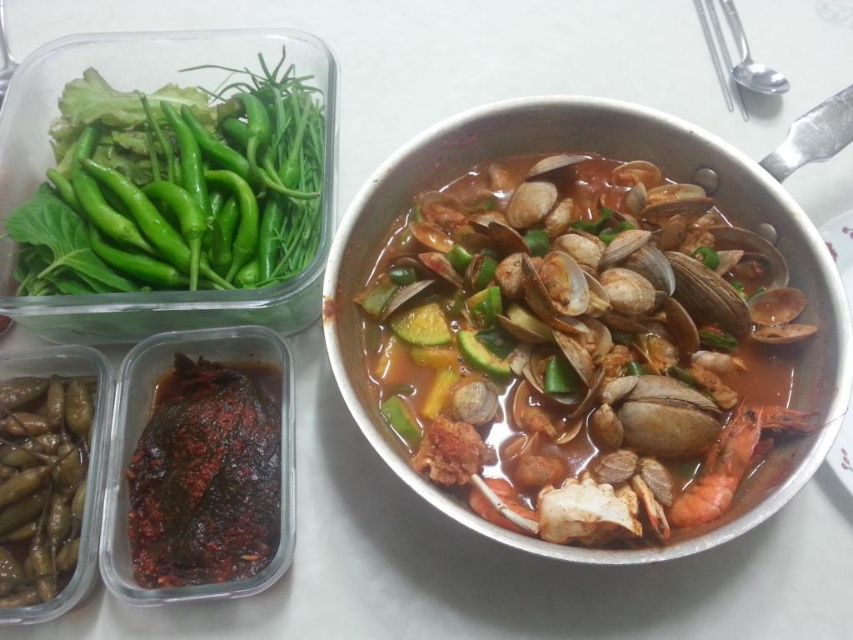
Question: Which point is farther to the camera?

Choices:
 (A) 91,72
 (B) 726,440

Answer: (A)

Question: Estimate the real-world distances between objects in this image. Which object is farther from the brown glossy clams at center?

Choices:
 (A) pickled green beans at lower left
 (B) green glossy chili peppers at upper left
 (C) shiny orange shrimp at right

Answer: (A)

Question: Is the position of green glossy chili peppers at upper left less distant than that of shiny orange shrimp at right?

Choices:
 (A) no
 (B) yes

Answer: (A)

Question: Does green glossy chili peppers at upper left have a greater width compared to dark brown glossy fish at lower left?

Choices:
 (A) yes
 (B) no

Answer: (A)

Question: Is brown glossy clams at center below dark brown glossy fish at lower left?

Choices:
 (A) yes
 (B) no

Answer: (B)

Question: Considering the real-world distances, which object is closest to the brown glossy clams at center?

Choices:
 (A) dark brown glossy fish at lower left
 (B) pickled green beans at lower left
 (C) shiny orange shrimp at right

Answer: (C)